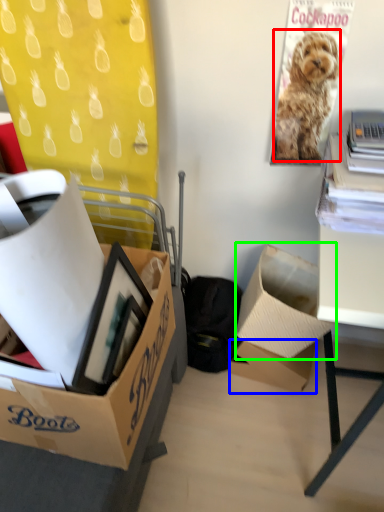
Question: Based on their relative distances, which object is farther from dog (highlighted by a red box)? Choose from box (highlighted by a blue box) and box (highlighted by a green box).

Choices:
 (A) box
 (B) box

Answer: (A)